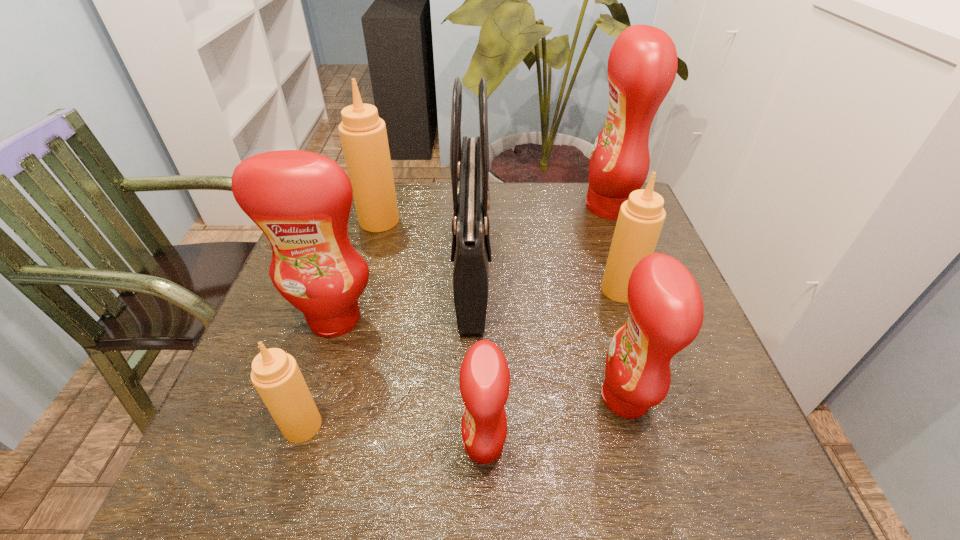
Where is `free point located 0.170m on the label side of the second smallest red condiment`? free point located 0.170m on the label side of the second smallest red condiment is located at coordinates (505, 398).

Identify the location of vacant space located 0.400m on the label side of the second smallest red condiment. The image size is (960, 540). (378, 398).

Identify the location of free region located 0.160m on the back of the nearest tan condiment. (330, 339).

Where is `free space located 0.400m on the label side of the fourth condiment from right to left`? The height and width of the screenshot is (540, 960). free space located 0.400m on the label side of the fourth condiment from right to left is located at coordinates (223, 446).

You are a GUI agent. You are given a task and a screenshot of the screen. Output one action in this format:
    pyautogui.click(x=<x>, y=<y>)
    Task: Click on the vacant space located on the label side of the fourth condiment from right to left
    The image size is (960, 540).
    Given the screenshot: What is the action you would take?
    pyautogui.click(x=240, y=446)

Where is `free spot located 0.060m on the label side of the fourth condiment from right to left`? free spot located 0.060m on the label side of the fourth condiment from right to left is located at coordinates (426, 446).

Where is `handbag at the far edge`? Image resolution: width=960 pixels, height=540 pixels. handbag at the far edge is located at coordinates (471, 250).

At what (x,y) coordinates should I click in order to perform the action: click on object that is at the near edge. Please return your answer as a coordinate pair (x, y). The width and height of the screenshot is (960, 540). Looking at the image, I should click on (484, 380).

Where is `object located at the far left corner`? object located at the far left corner is located at coordinates (363, 134).

Locate an element on the screen. This screenshot has height=540, width=960. object that is at the far right corner is located at coordinates (642, 65).